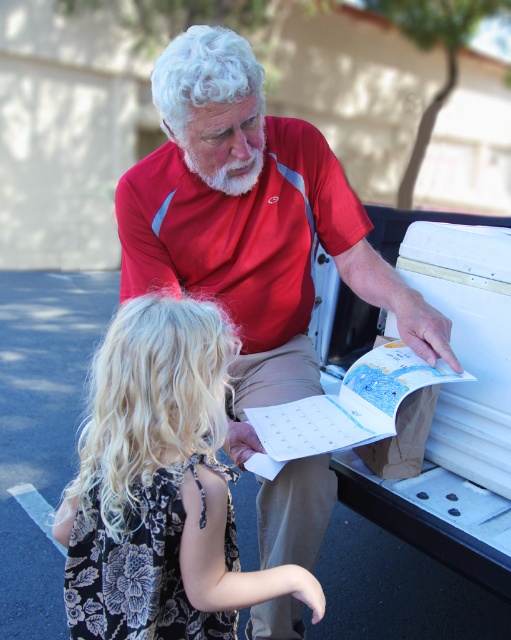
You are a photographer trying to capture a photo of the black floral dress at lower left and the red polyester polo shirt at upper center. Which object is located lower in the frame?

The black floral dress at lower left is positioned under the red polyester polo shirt at upper center, so it is lower in the frame.

You are standing in front of the outdoor scene and want to take a photo. There are two points marked in the image at coordinates point (137, 563) and point (282, 326). Which point is closer to you?

Point (137, 563) is closer to the camera than point (282, 326).